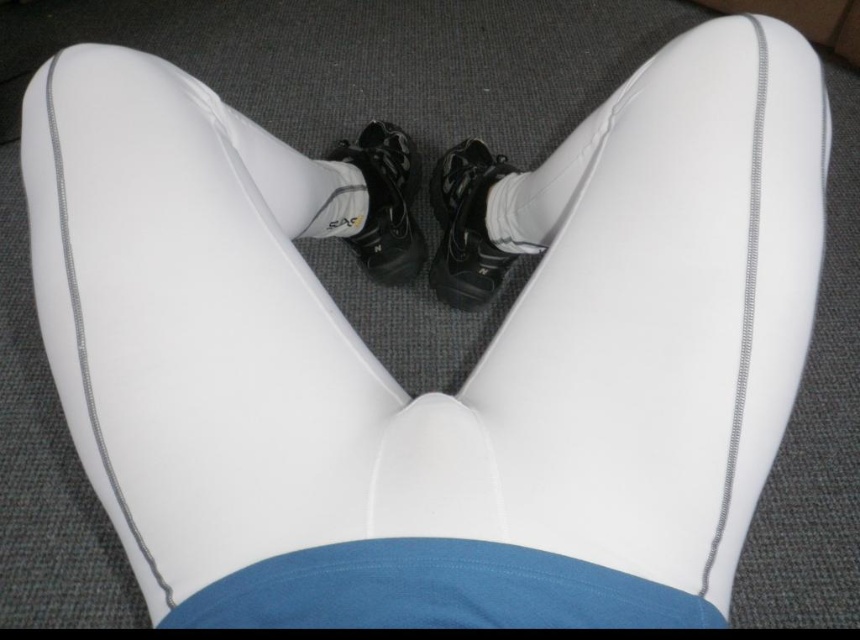
Question: Does black matte shoe at center lie in front of shiny black shoe at center?

Choices:
 (A) no
 (B) yes

Answer: (B)

Question: Does shiny black shoe at center appear over white fabric sock at center?

Choices:
 (A) no
 (B) yes

Answer: (B)

Question: Is black matte shoe at center thinner than white fabric sock at center?

Choices:
 (A) yes
 (B) no

Answer: (B)

Question: Which point is farther from the camera taking this photo?

Choices:
 (A) (394, 182)
 (B) (490, 188)
 (C) (484, 292)

Answer: (A)

Question: Which object is the closest to the white fabric sock at center?

Choices:
 (A) black matte shoe at center
 (B) shiny black shoe at center

Answer: (A)

Question: Which point is closer to the camera?

Choices:
 (A) (538, 186)
 (B) (387, 220)
 (C) (483, 209)

Answer: (A)